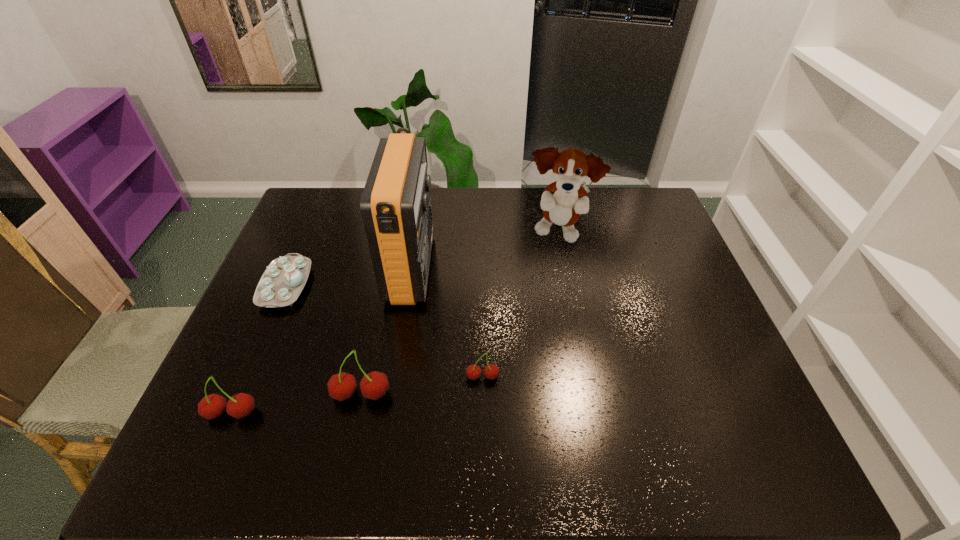
You are a GUI agent. You are given a task and a screenshot of the screen. Output one action in this format:
    pyautogui.click(x=<x>, y=<y>)
    Task: Click on the leftmost cherry
    Image resolution: width=960 pixels, height=540 pixels.
    Given the screenshot: What is the action you would take?
    pyautogui.click(x=241, y=405)

You are a GUI agent. You are given a task and a screenshot of the screen. Output one action in this format:
    pyautogui.click(x=<x>, y=<y>)
    Task: Click on the second tallest cherry
    Image resolution: width=960 pixels, height=540 pixels.
    Given the screenshot: What is the action you would take?
    pyautogui.click(x=241, y=405)

Where is `the second cherry from left to right`? The image size is (960, 540). the second cherry from left to right is located at coordinates (341, 386).

What are the coordinates of `the rightmost cherry` in the screenshot? It's located at (491, 371).

Image resolution: width=960 pixels, height=540 pixels. Identify the location of the second object from right to left. (491, 371).

Where is `the fifth shortest object`? This screenshot has width=960, height=540. the fifth shortest object is located at coordinates (562, 202).

Find the location of a particular element. the rightmost object is located at coordinates click(x=562, y=202).

This screenshot has height=540, width=960. I want to click on radio receiver, so click(396, 210).

The width and height of the screenshot is (960, 540). In order to click on the shortest object in this screenshot , I will do `click(282, 282)`.

What are the coordinates of `vacant area situated on the face of the puppy` in the screenshot? It's located at (574, 315).